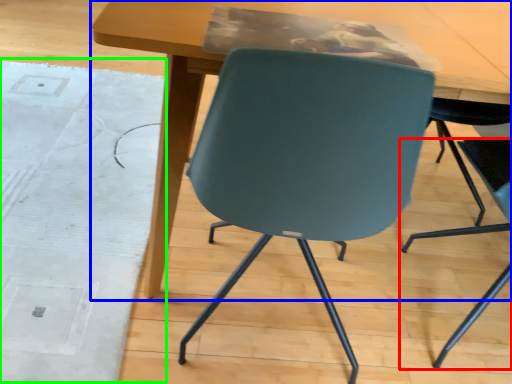
Question: Which is nearer to the chair (highlighted by a red box)? table (highlighted by a blue box) or mat (highlighted by a green box).

Choices:
 (A) table
 (B) mat

Answer: (A)